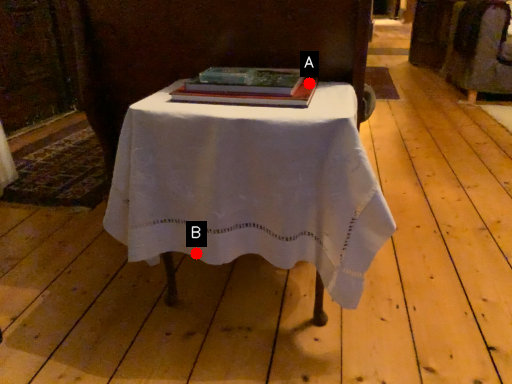
Question: Two points are circled on the image, labeled by A and B beside each circle. Which point is farther to the camera?

Choices:
 (A) A is further
 (B) B is further

Answer: (A)